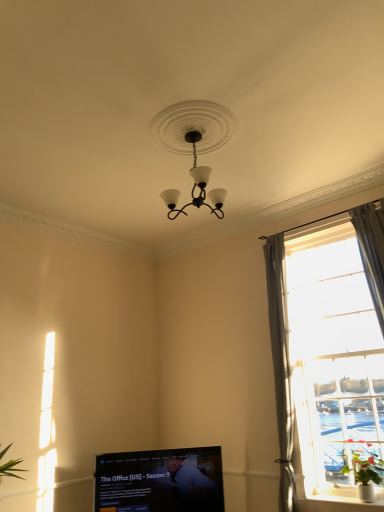
Question: Can you confirm if matte black chandelier at center is bigger than matte black television at lower center?

Choices:
 (A) no
 (B) yes

Answer: (A)

Question: Is matte black chandelier at center positioned behind matte black television at lower center?

Choices:
 (A) no
 (B) yes

Answer: (A)

Question: Is matte black chandelier at center oriented towards matte black television at lower center?

Choices:
 (A) no
 (B) yes

Answer: (A)

Question: From a real-world perspective, is matte black chandelier at center physically below matte black television at lower center?

Choices:
 (A) no
 (B) yes

Answer: (A)

Question: Can you confirm if matte black chandelier at center is positioned to the right of matte black television at lower center?

Choices:
 (A) yes
 (B) no

Answer: (A)

Question: Is matte black chandelier at center turned away from matte black television at lower center?

Choices:
 (A) no
 (B) yes

Answer: (A)

Question: Does matte black television at lower center have a larger size compared to green leafy plant at right?

Choices:
 (A) yes
 (B) no

Answer: (A)

Question: Can you confirm if matte black television at lower center is shorter than green leafy plant at right?

Choices:
 (A) no
 (B) yes

Answer: (A)

Question: From the image's perspective, is matte black television at lower center on green leafy plant at right?

Choices:
 (A) yes
 (B) no

Answer: (B)

Question: Can you confirm if matte black television at lower center is wider than green leafy plant at right?

Choices:
 (A) yes
 (B) no

Answer: (B)

Question: Is matte black television at lower center not near green leafy plant at right?

Choices:
 (A) no
 (B) yes

Answer: (B)

Question: Is matte black television at lower center smaller than green leafy plant at right?

Choices:
 (A) no
 (B) yes

Answer: (A)

Question: From the image's perspective, is matte black television at lower center located above matte black chandelier at center?

Choices:
 (A) yes
 (B) no

Answer: (B)